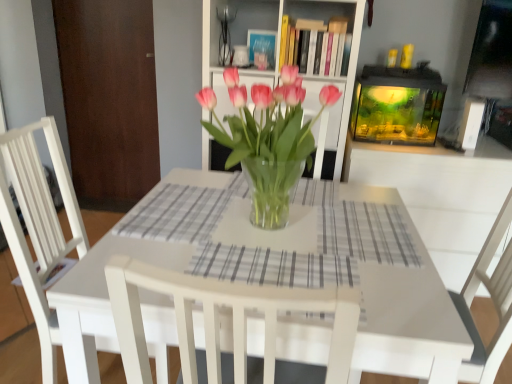
Image resolution: width=512 pixels, height=384 pixels. In order to click on free space underneath translucent glass vase at center (from a real-world perspective) in this screenshot , I will do `click(267, 224)`.